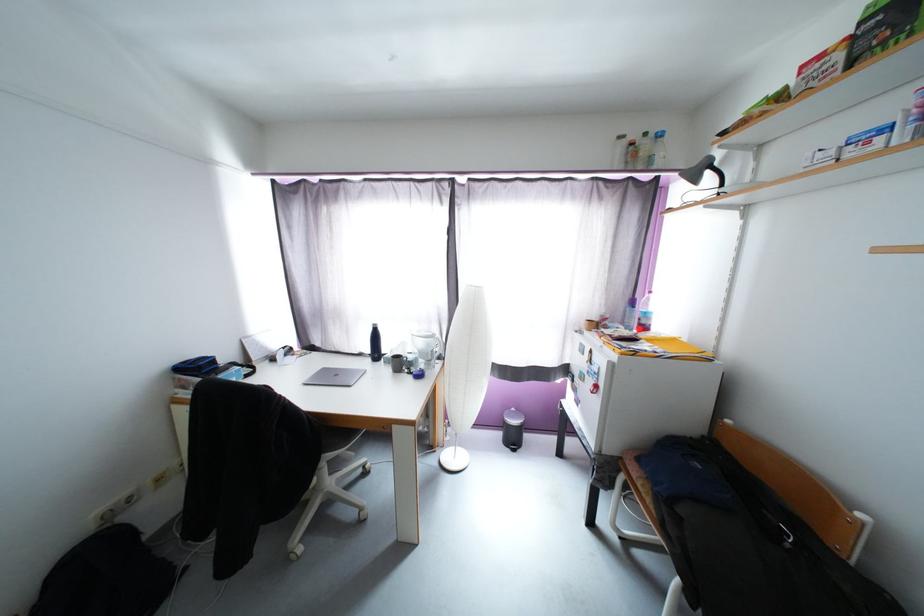
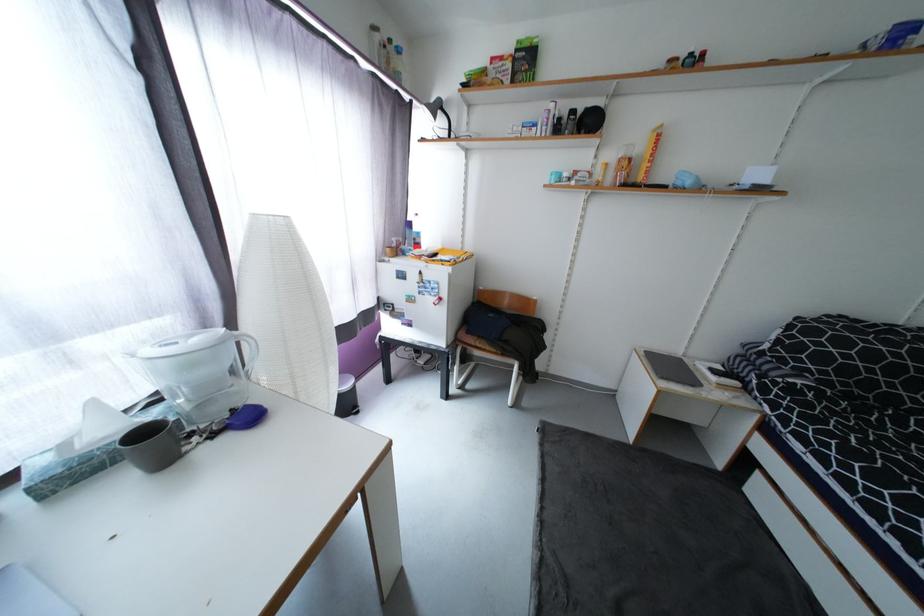
Find the pixel in the second image that matches (x=845, y=57) in the first image.

(515, 66)